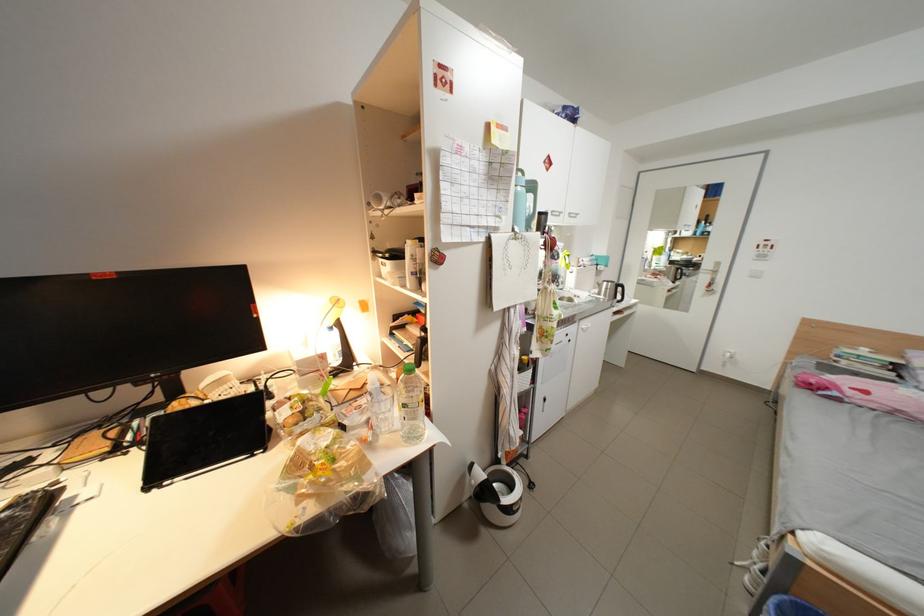
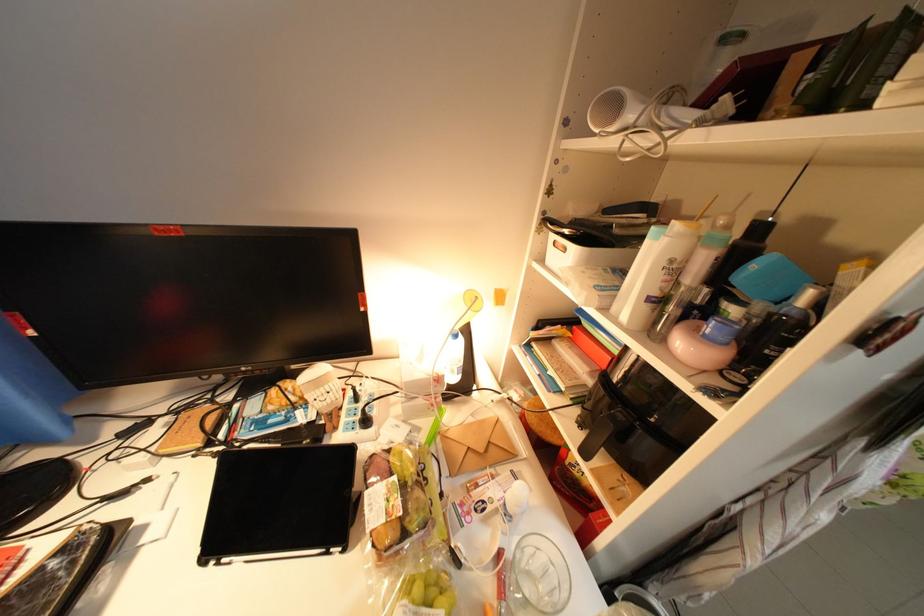
In the second image, find the point that corresponds to point 423,275 in the first image.

(661, 301)